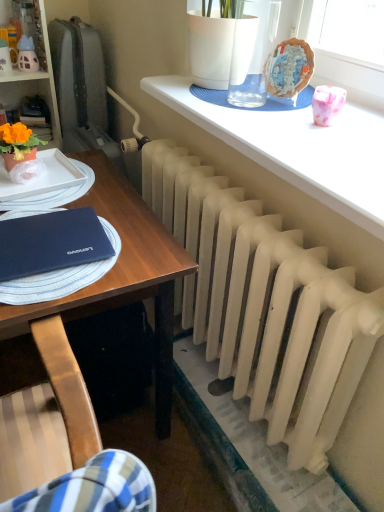
Question: Is white matte desk at center next to white matte radiator at lower center?

Choices:
 (A) yes
 (B) no

Answer: (B)

Question: Is white matte desk at center shorter than white matte radiator at lower center?

Choices:
 (A) no
 (B) yes

Answer: (A)

Question: Does white matte desk at center have a smaller size compared to white matte radiator at lower center?

Choices:
 (A) no
 (B) yes

Answer: (A)

Question: From a real-world perspective, is white matte desk at center positioned under white matte radiator at lower center based on gravity?

Choices:
 (A) yes
 (B) no

Answer: (A)

Question: Is white matte desk at center outside white matte radiator at lower center?

Choices:
 (A) no
 (B) yes

Answer: (B)

Question: Is white matte desk at center bigger than white matte radiator at lower center?

Choices:
 (A) no
 (B) yes

Answer: (B)

Question: Is matte black notebook at left behind orange matte flower pot at left?

Choices:
 (A) yes
 (B) no

Answer: (B)

Question: Can you confirm if matte black notebook at left is wider than orange matte flower pot at left?

Choices:
 (A) yes
 (B) no

Answer: (A)

Question: Does matte black notebook at left have a lesser height compared to orange matte flower pot at left?

Choices:
 (A) yes
 (B) no

Answer: (A)

Question: Is the position of matte black notebook at left less distant than that of orange matte flower pot at left?

Choices:
 (A) no
 (B) yes

Answer: (B)

Question: Does matte black notebook at left have a lesser width compared to orange matte flower pot at left?

Choices:
 (A) yes
 (B) no

Answer: (B)

Question: Considering the relative sizes of matte black notebook at left and orange matte flower pot at left in the image provided, is matte black notebook at left smaller than orange matte flower pot at left?

Choices:
 (A) no
 (B) yes

Answer: (A)

Question: Does white matte desk at center have a smaller size compared to matte black notebook at left?

Choices:
 (A) yes
 (B) no

Answer: (B)